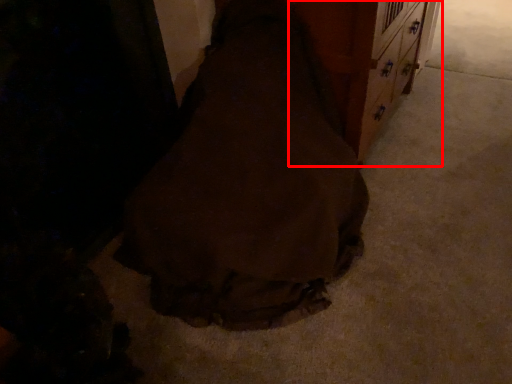
Question: From the image's perspective, considering the relative positions of dresser (annotated by the red box) and fancy dress in the image provided, where is dresser (annotated by the red box) located with respect to the staircase?

Choices:
 (A) below
 (B) above

Answer: (B)